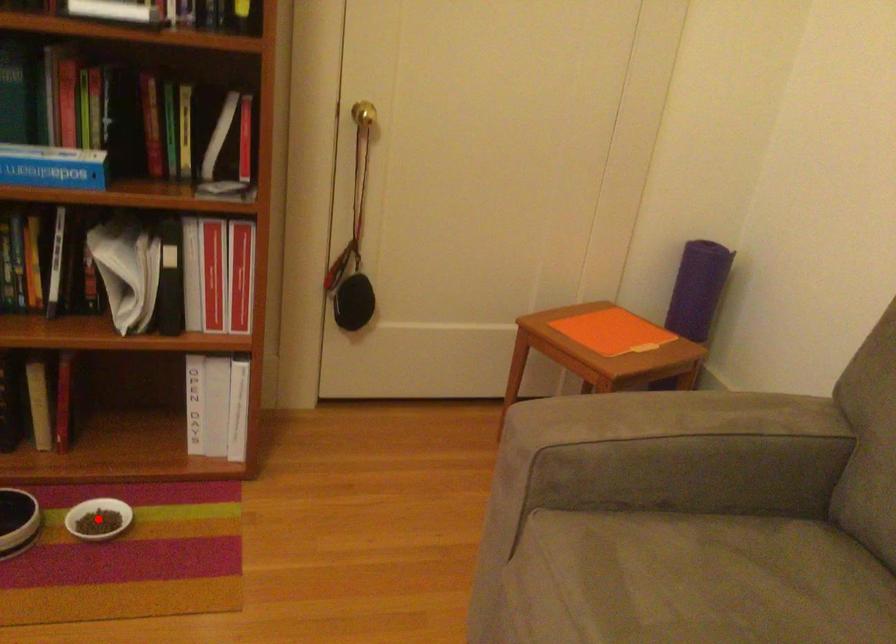
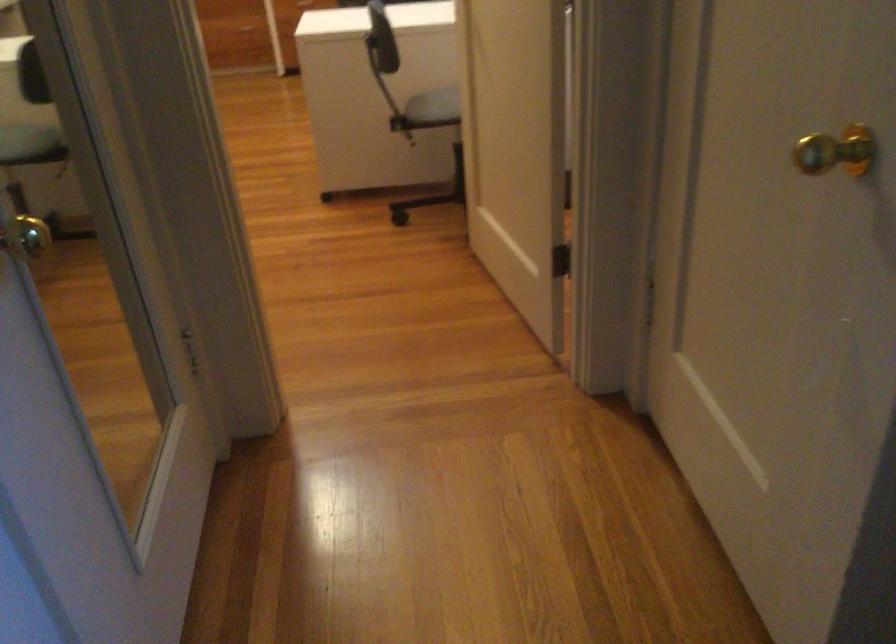
Question: I am providing you with two images of the same scene from different viewpoints. A red point is marked on the first image. At the location where the point appears in image 1, is it still visible in image 2?

Choices:
 (A) Yes
 (B) No

Answer: (B)